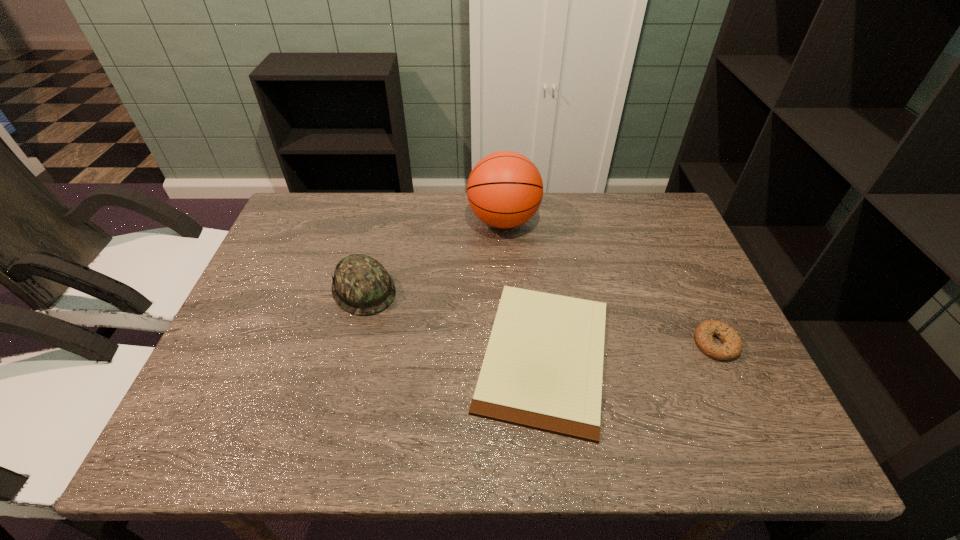
You are a GUI agent. You are given a task and a screenshot of the screen. Output one action in this format:
    pyautogui.click(x=<x>, y=<y>)
    Task: Click on the free region located 0.120m on the right of the shortest object
    The height and width of the screenshot is (540, 960).
    Given the screenshot: What is the action you would take?
    pyautogui.click(x=672, y=355)

Find the location of `object present at the far edge`. object present at the far edge is located at coordinates click(505, 189).

You are a GUI agent. You are given a task and a screenshot of the screen. Output one action in this format:
    pyautogui.click(x=<x>, y=<y>)
    Task: Click on the object that is at the near edge
    
    Given the screenshot: What is the action you would take?
    pyautogui.click(x=543, y=367)

Find the location of a particular element. The image size is (960, 540). object present at the right edge is located at coordinates pos(732,346).

Where is `vacant space at the far edge of the desktop`? The width and height of the screenshot is (960, 540). vacant space at the far edge of the desktop is located at coordinates (542, 221).

At what (x,y) coordinates should I click in order to perform the action: click on vacant space at the near edge of the desktop. Please return your answer as a coordinate pair (x, y). The width and height of the screenshot is (960, 540). Looking at the image, I should click on (645, 448).

What are the coordinates of `vacant space at the left edge` in the screenshot? It's located at (268, 290).

Where is `vacant space at the right edge of the desktop`? The image size is (960, 540). vacant space at the right edge of the desktop is located at coordinates (679, 372).

Where is `free location at the far left corner`? The height and width of the screenshot is (540, 960). free location at the far left corner is located at coordinates (305, 203).

In order to click on vacant space at the far right corner in this screenshot , I will do `click(654, 216)`.